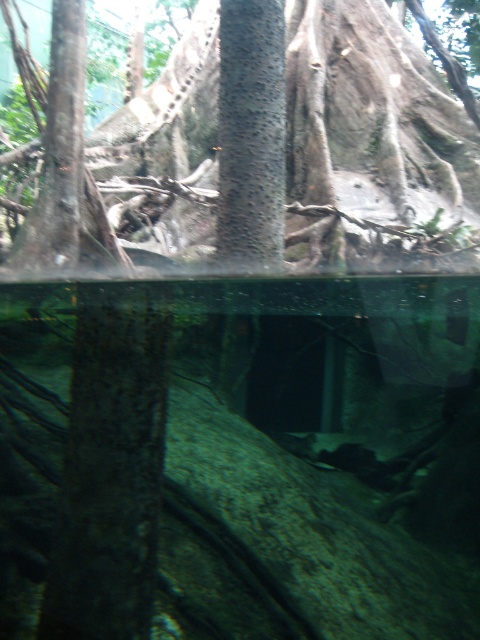
Question: Among these objects, which one is nearest to the camera?

Choices:
 (A) dark brown rough tree trunk at center
 (B) rough bark tree trunk at center

Answer: (A)

Question: In this image, where is dark brown rough tree trunk at center located relative to rough bark tree trunk at center?

Choices:
 (A) left
 (B) right

Answer: (A)

Question: Can you confirm if rough bark tree at center is positioned above dark brown rough tree trunk at center?

Choices:
 (A) yes
 (B) no

Answer: (A)

Question: Does green translucent water at center come in front of rough bark tree at center?

Choices:
 (A) no
 (B) yes

Answer: (B)

Question: Which point is closer to the camera?

Choices:
 (A) green translucent water at center
 (B) dark brown rough tree trunk at center

Answer: (B)

Question: Which of the following is the closest to the observer?

Choices:
 (A) (348, 10)
 (B) (147, 452)
 (C) (275, 124)
 (D) (85, 380)

Answer: (D)